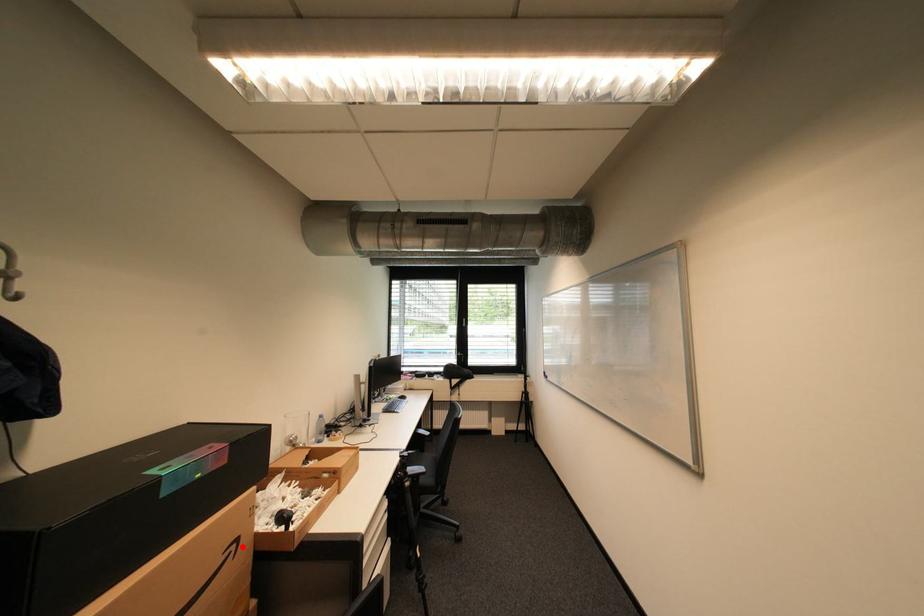
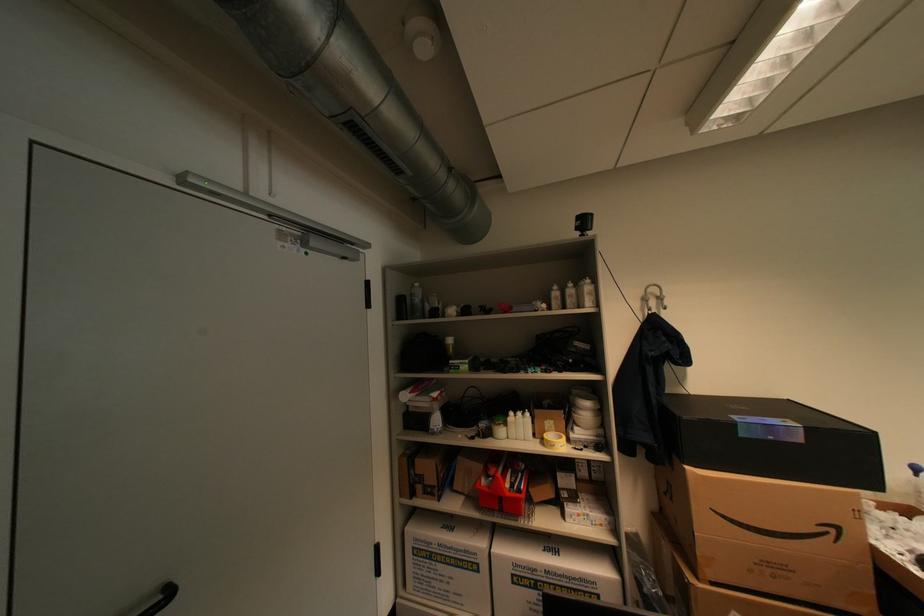
In the second image, find the point that corresponds to the highlighted location in the first image.

(841, 531)